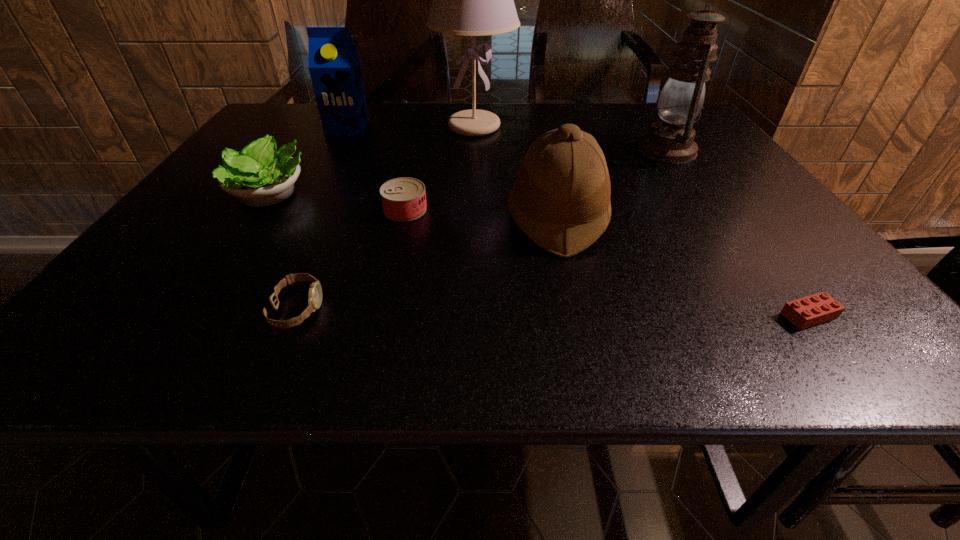
I want to click on free region located with the cap open on the carton, so click(316, 187).

The width and height of the screenshot is (960, 540). What are the coordinates of `free space located 0.370m on the front-facing side of the hat` in the screenshot? It's located at (334, 219).

This screenshot has width=960, height=540. I want to click on free region located on the front-facing side of the hat, so tap(474, 219).

Locate an element on the screen. The image size is (960, 540). free point located on the front-facing side of the hat is located at coordinates pyautogui.click(x=321, y=219).

Find the location of a particular element. vacant position located 0.120m on the front of the lettuce is located at coordinates (227, 258).

Where is `free space located on the left of the can`? free space located on the left of the can is located at coordinates (275, 210).

The width and height of the screenshot is (960, 540). Find the location of `vacant region located 0.300m on the face of the watch`. vacant region located 0.300m on the face of the watch is located at coordinates (497, 309).

Image resolution: width=960 pixels, height=540 pixels. What are the coordinates of `free space located on the back of the shortest object` in the screenshot? It's located at (731, 211).

This screenshot has height=540, width=960. Find the location of `lampshade present at the far edge`. lampshade present at the far edge is located at coordinates (472, 0).

The height and width of the screenshot is (540, 960). I want to click on carton present at the far edge, so click(x=333, y=62).